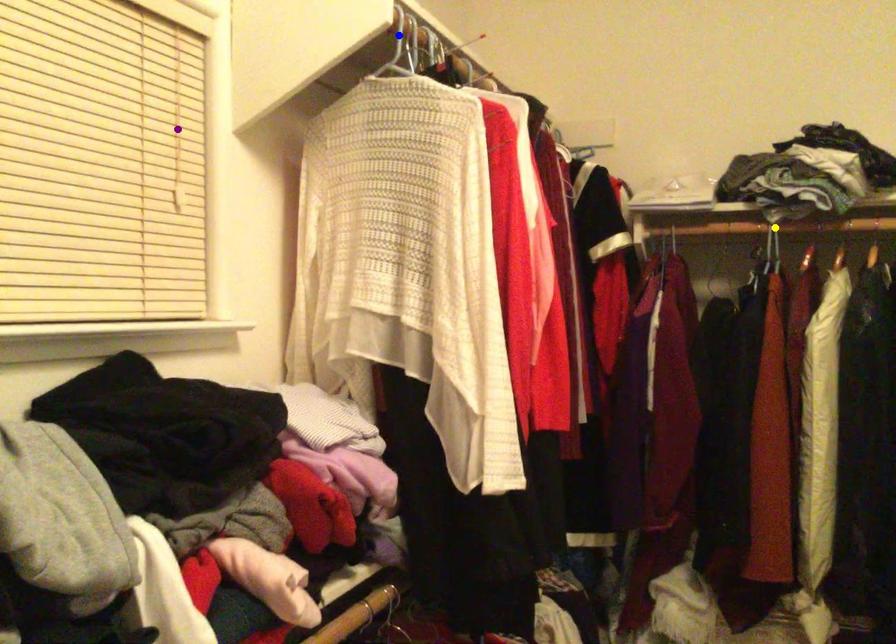
Order these from nearest to farthest:
1. yellow point
2. blue point
3. purple point

yellow point, blue point, purple point